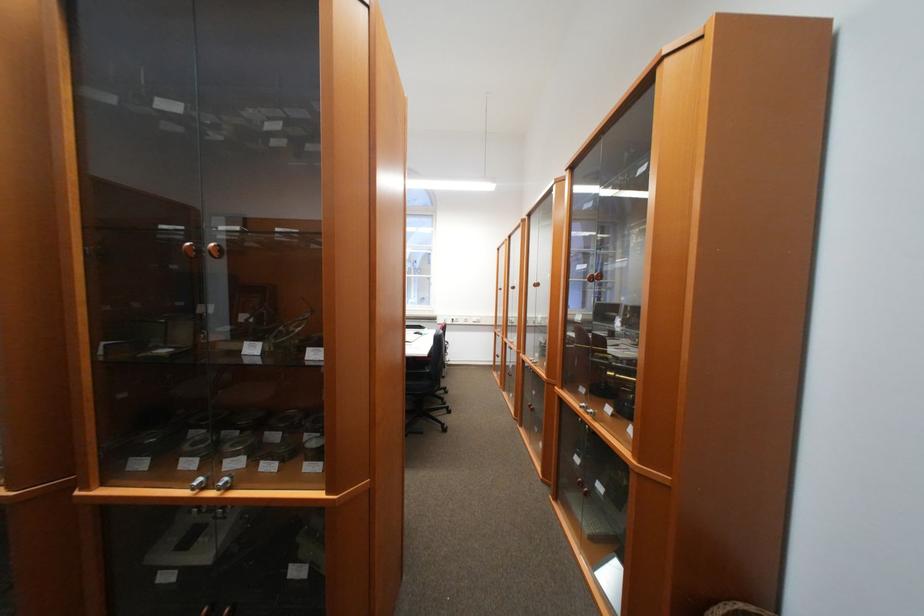
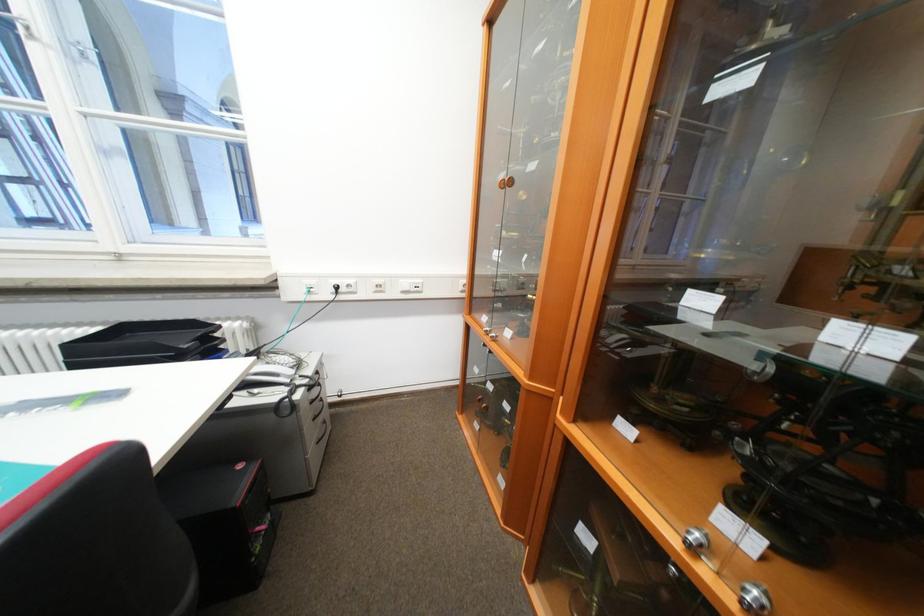
Question: What movement of the cameraman would produce the second image?

Choices:
 (A) Left
 (B) Right
 (C) Forward
 (D) Backward

Answer: (C)